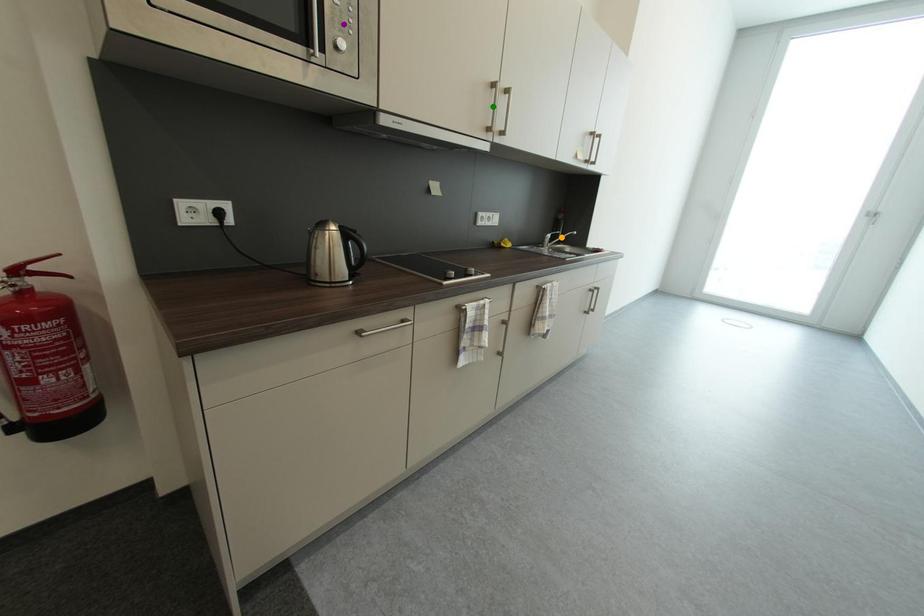
Order these from farthest to nearest:
orange point | purple point | green point

orange point < green point < purple point